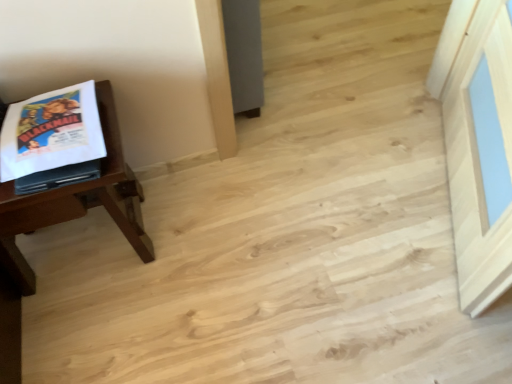
Measure the distance between point (93, 154) and camera.

Point (93, 154) and camera are 36.42 inches apart from each other.

The image size is (512, 384). I want to click on white paper comic book at left, so click(x=51, y=132).

This screenshot has width=512, height=384. What do you see at coordinates (51, 132) in the screenshot?
I see `white paper comic book at left` at bounding box center [51, 132].

What is the approximate width of wooden table at left?

wooden table at left is 33.96 centimeters in width.

Identify the location of wooden table at left. The height and width of the screenshot is (384, 512). (76, 202).

Describe the element at coordinates (76, 202) in the screenshot. I see `wooden table at left` at that location.

Find the location of a particular element. This screenshot has height=384, width=512. white paper comic book at left is located at coordinates (51, 132).

Considering the relative positions of white paper comic book at left and wooden table at left in the image provided, is white paper comic book at left to the left or to the right of wooden table at left?

Based on their positions, white paper comic book at left is located to the right of wooden table at left.

Relative to wooden table at left, is white paper comic book at left in front or behind?

In the image, white paper comic book at left appears behind wooden table at left.

Is point (88, 112) more distant than point (20, 223)?

That is False.

From the image's perspective, between white paper comic book at left and wooden table at left, who is located below?

wooden table at left, from the image's perspective.

From a real-world perspective, between white paper comic book at left and wooden table at left, who is vertically higher?

white paper comic book at left is physically above.

Does white paper comic book at left have a greater width compared to wooden table at left?

No, white paper comic book at left is not wider than wooden table at left.

Which of these two, white paper comic book at left or wooden table at left, stands taller?

Standing taller between the two is wooden table at left.

In terms of size, does white paper comic book at left appear bigger or smaller than wooden table at left?

Clearly, white paper comic book at left is smaller in size than wooden table at left.

Would you say white paper comic book at left is outside wooden table at left?

No, white paper comic book at left is not entirely external to wooden table at left.

Is white paper comic book at left beside wooden table at left?

They are not placed beside each other.

Is white paper comic book at left aimed at wooden table at left?

Yes, white paper comic book at left is facing wooden table at left.

How different are the orientations of white paper comic book at left and wooden table at left in degrees?

There is a 3.84-degree angle between the facing directions of white paper comic book at left and wooden table at left.

How distant is white paper comic book at left from wooden table at left?

6.09 inches.

Locate an element on the screen. comic book on the right of the wooden table at left is located at coordinates (51, 132).

Is wooden table at left at the left side of white paper comic book at left?

Correct, you'll find wooden table at left to the left of white paper comic book at left.

Who is more distant, wooden table at left or white paper comic book at left?

white paper comic book at left.

Does point (103, 124) come farther from viewer compared to point (86, 110)?

Yes, point (103, 124) is behind point (86, 110).

From the image's perspective, is wooden table at left on top of white paper comic book at left?

No, from the image's perspective, wooden table at left is not on top of white paper comic book at left.

From a real-world perspective, which object stands above the other?

white paper comic book at left.

Considering the relative sizes of wooden table at left and white paper comic book at left in the image provided, is wooden table at left wider than white paper comic book at left?

Correct, the width of wooden table at left exceeds that of white paper comic book at left.

Is wooden table at left shorter than white paper comic book at left?

In fact, wooden table at left may be taller than white paper comic book at left.

Considering the relative sizes of wooden table at left and white paper comic book at left in the image provided, is wooden table at left bigger than white paper comic book at left?

Correct, wooden table at left is larger in size than white paper comic book at left.

Is white paper comic book at left inside wooden table at left?

Yes, white paper comic book at left is surrounded by wooden table at left.

Are wooden table at left and white paper comic book at left making contact?

No, wooden table at left is not beside white paper comic book at left.

Is wooden table at left looking in the opposite direction of white paper comic book at left?

No, wooden table at left's orientation is not away from white paper comic book at left.

At what (x,y) coordinates should I click in order to perform the action: click on table below the white paper comic book at left (from the image's perspective). Please return your answer as a coordinate pair (x, y). Looking at the image, I should click on (76, 202).

Find the location of a particular element. The image size is (512, 384). table that is below the white paper comic book at left (from the image's perspective) is located at coordinates (76, 202).

The height and width of the screenshot is (384, 512). What are the coordinates of `table in front of the white paper comic book at left` in the screenshot? It's located at (76, 202).